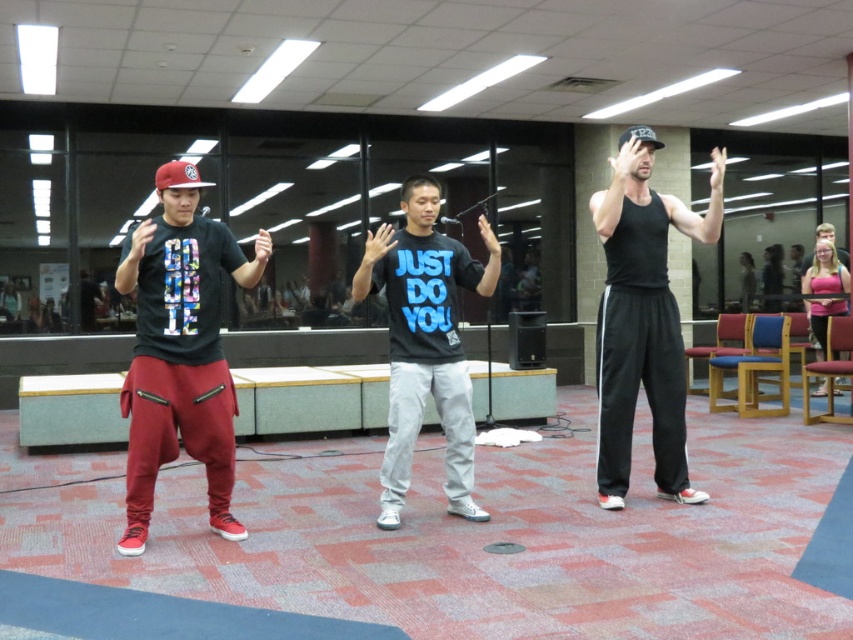
Question: Based on their relative distances, which object is farther from the black matte t-shirt at center?

Choices:
 (A) matte black t-shirt at center
 (B) black tank top at right

Answer: (B)

Question: Does matte black t-shirt at center have a lesser width compared to black tank top at right?

Choices:
 (A) no
 (B) yes

Answer: (A)

Question: Is matte black t-shirt at center bigger than black matte t-shirt at center?

Choices:
 (A) yes
 (B) no

Answer: (B)

Question: Is matte black t-shirt at center below black tank top at right?

Choices:
 (A) no
 (B) yes

Answer: (B)

Question: Which of the following is the farthest from the observer?

Choices:
 (A) (196, 356)
 (B) (431, 321)

Answer: (B)

Question: Which point is farther to the camera?

Choices:
 (A) [x=621, y=502]
 (B) [x=166, y=371]
 (C) [x=474, y=515]

Answer: (A)